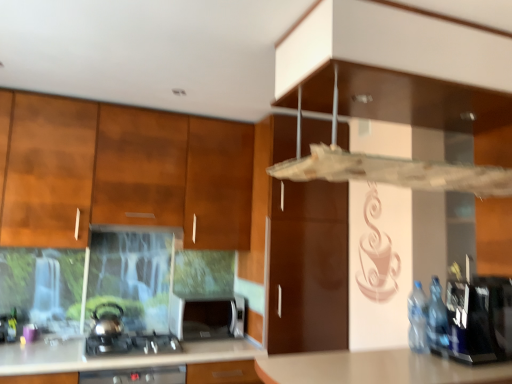
This screenshot has height=384, width=512. Identify the location of vacant space to the right of satin silver kettle at lower left. (145, 334).